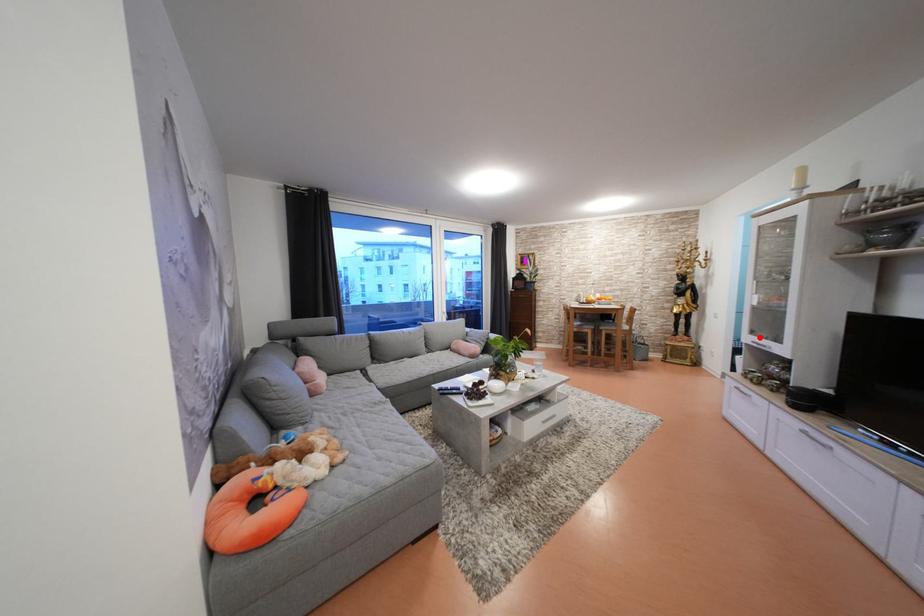
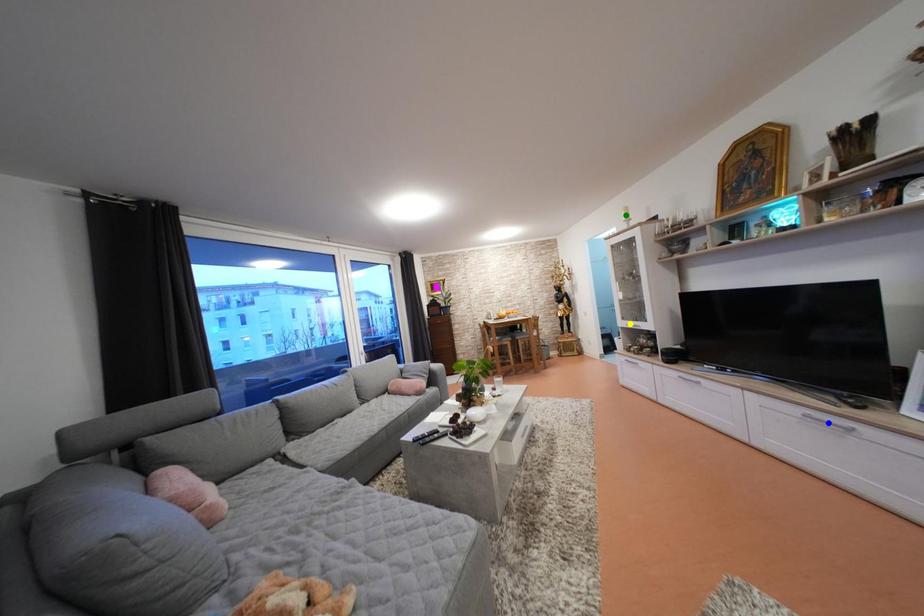
Question: I am providing you with two images of the same scene from different viewpoints. A red point is marked on the first image. You are given multiple points on the second image. Which spot in image 2 lines up with the point in image 1?

Choices:
 (A) blue point
 (B) yellow point
 (C) green point

Answer: (B)